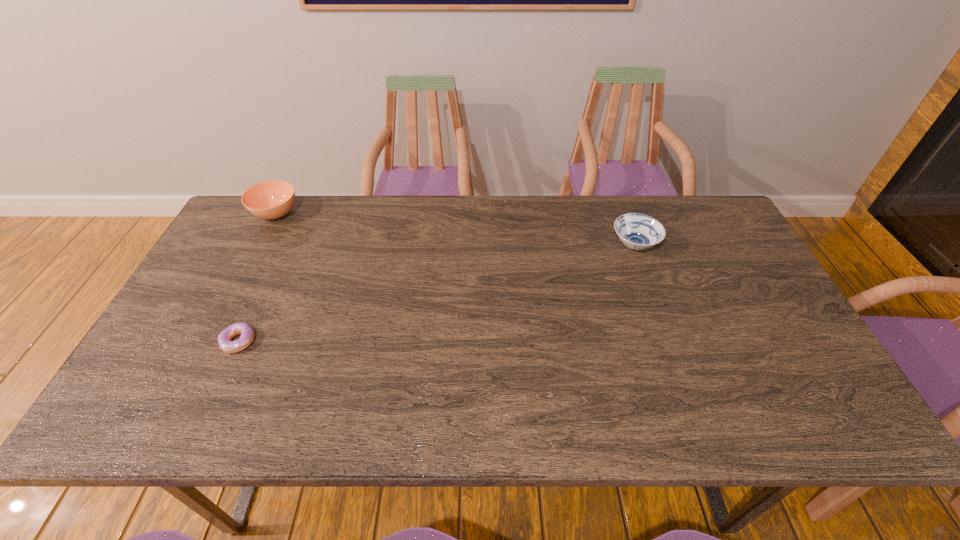
You are a GUI agent. You are given a task and a screenshot of the screen. Output one action in this format:
    pyautogui.click(x=<x>, y=<y>)
    Task: Click on the farthest object
    
    Given the screenshot: What is the action you would take?
    pyautogui.click(x=272, y=199)

Image resolution: width=960 pixels, height=540 pixels. I want to click on the left soup bowl, so click(x=272, y=199).

Image resolution: width=960 pixels, height=540 pixels. Identify the location of the rightmost object. (637, 231).

This screenshot has height=540, width=960. Identify the location of the nearer soup bowl. (637, 231).

Locate an element on the screen. Image resolution: width=960 pixels, height=540 pixels. the nearest object is located at coordinates (247, 334).

The image size is (960, 540). Find the location of `doughnut`. doughnut is located at coordinates (247, 334).

Where is `free space located on the front of the farther soup bowl`? free space located on the front of the farther soup bowl is located at coordinates (223, 315).

Locate an element on the screen. vacant space located on the left of the right soup bowl is located at coordinates (527, 246).

You are a GUI agent. You are given a task and a screenshot of the screen. Output one action in this format:
    pyautogui.click(x=<x>, y=<y>)
    Task: Click on the free space located on the front of the nearest object
    The width and height of the screenshot is (960, 540).
    Given the screenshot: What is the action you would take?
    pyautogui.click(x=204, y=417)

The height and width of the screenshot is (540, 960). I want to click on soup bowl located at the left edge, so click(272, 199).